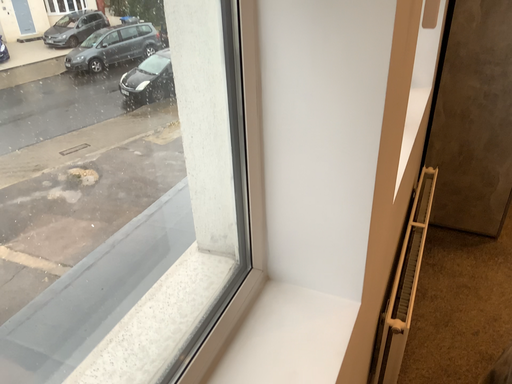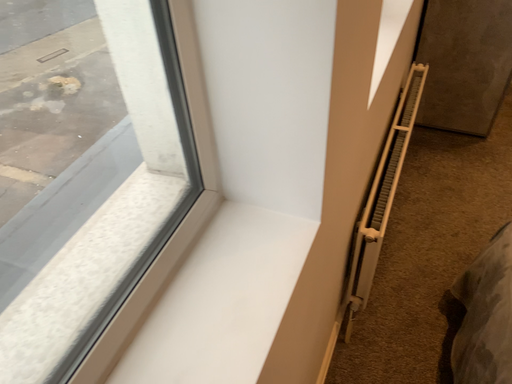
Question: How did the camera likely rotate when shooting the video?

Choices:
 (A) rotated upward
 (B) rotated downward

Answer: (B)